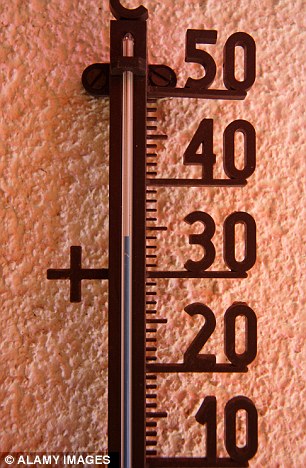
Locate an element on the screen. thermostat is located at coordinates (133, 28).